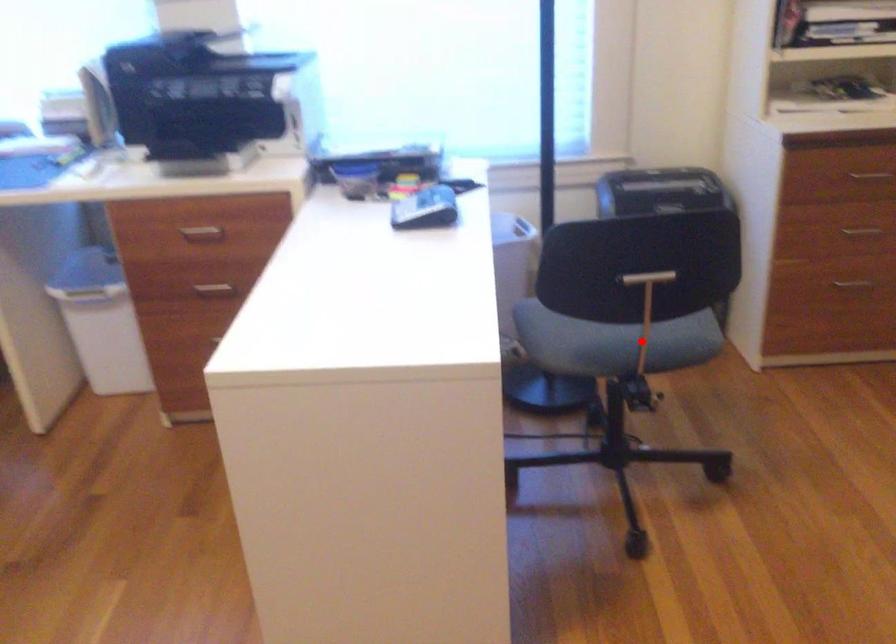
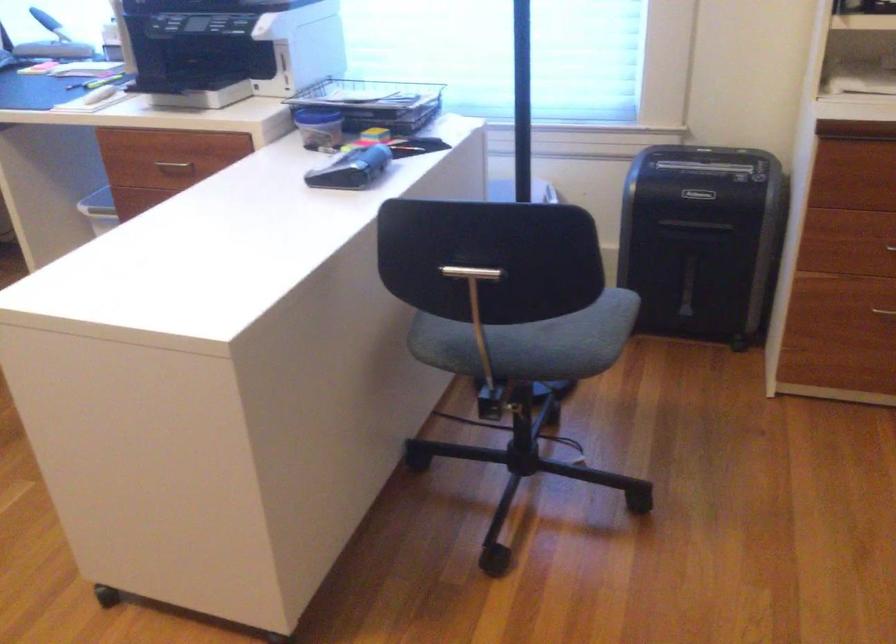
The point at the highlighted location is marked in the first image. Where is the corresponding point in the second image?

(531, 342)